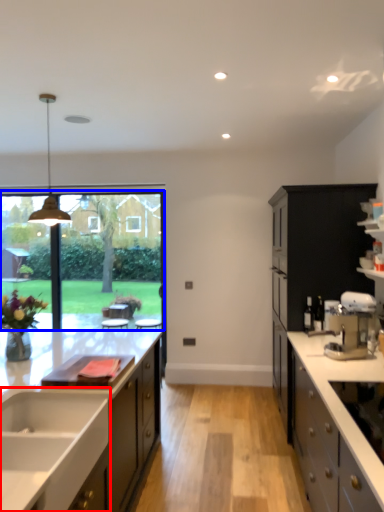
Question: Which object appears farthest to the camera in this image, sink (highlighted by a red box) or window screen (highlighted by a blue box)?

Choices:
 (A) sink
 (B) window screen

Answer: (B)